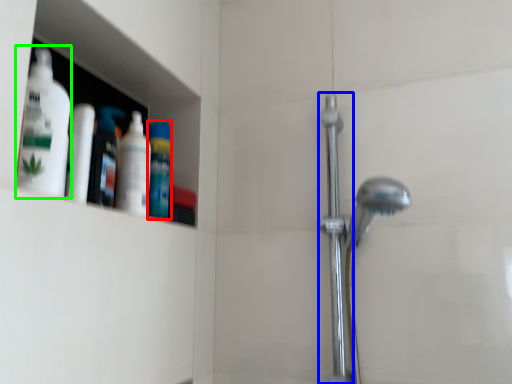
Question: Which object is the farthest from mouthwash (highlighted by a red box)? Choose among these: shower door (highlighted by a blue box) or cleaning product (highlighted by a green box).

Choices:
 (A) shower door
 (B) cleaning product

Answer: (A)